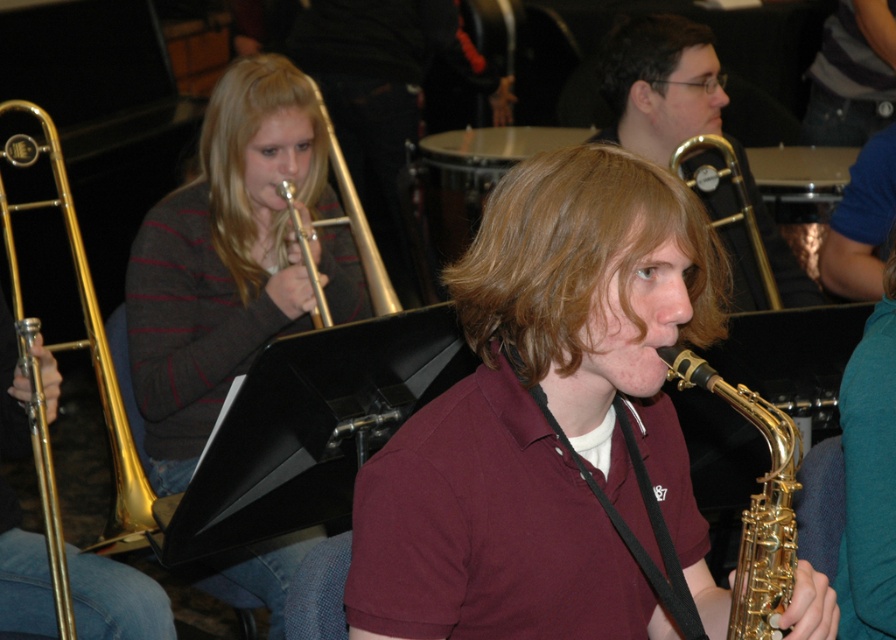
Question: Which point is closer to the camera?

Choices:
 (A) (700, 72)
 (B) (46, 444)
 (C) (168, 348)

Answer: (B)

Question: Is maroon shirt at center smaller than gold brass trombone at left?

Choices:
 (A) no
 (B) yes

Answer: (B)

Question: Can you confirm if matte gray sweater at upper left is positioned above blonde wavy hair at center?

Choices:
 (A) yes
 (B) no

Answer: (B)

Question: Which point is closer to the camera?

Choices:
 (A) (622, 100)
 (B) (639, 28)
 (C) (227, 136)
 (D) (297, 104)

Answer: (C)

Question: Does blonde wavy hair at center have a larger size compared to blondehair at upper left?

Choices:
 (A) no
 (B) yes

Answer: (B)

Question: Which of the following is the closest to the observer?

Choices:
 (A) matte gold trumpet at upper left
 (B) gold brass trombone at left
 (C) matte gray sweater at upper left

Answer: (B)